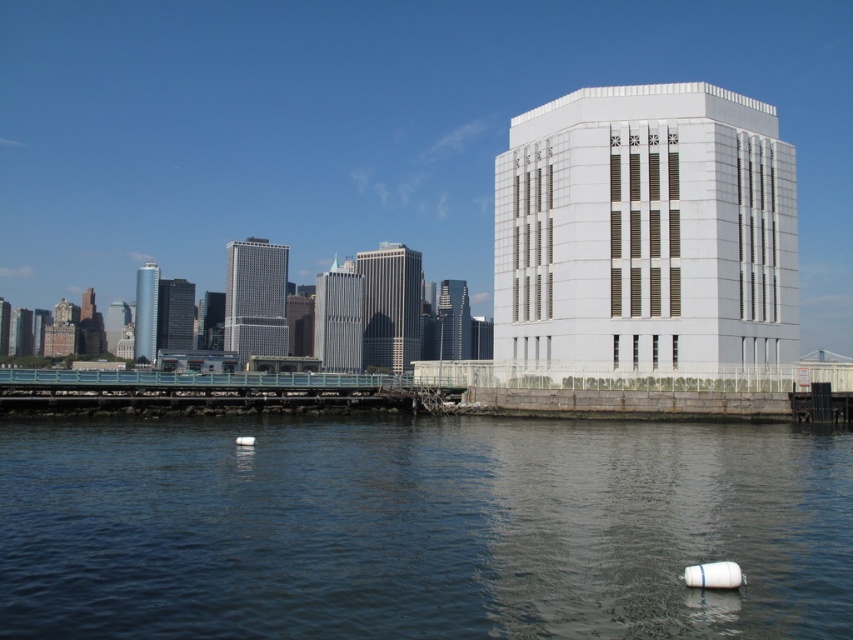
Can you confirm if silver reflective skyscraper at center is positioned to the left of black glass tower at center-left?

In fact, silver reflective skyscraper at center is to the right of black glass tower at center-left.

Between silver reflective skyscraper at center and black glass tower at center-left, which one is positioned higher?

Positioned higher is black glass tower at center-left.

Between point (270, 248) and point (183, 324), which one is positioned in front?

Point (270, 248) is in front.

Find the location of a particular element. This screenshot has width=853, height=640. silver reflective skyscraper at center is located at coordinates (254, 298).

Looking at this image, is clear water at lower center taller than shiny glass skyscraper at center?

Incorrect, clear water at lower center's height is not larger of shiny glass skyscraper at center's.

Can you confirm if clear water at lower center is smaller than shiny glass skyscraper at center?

Indeed, clear water at lower center has a smaller size compared to shiny glass skyscraper at center.

Where is `clear water at lower center`? The image size is (853, 640). clear water at lower center is located at coordinates (419, 529).

Who is more forward, (337, 500) or (225, 340)?

Point (337, 500)

I want to click on clear water at lower center, so click(419, 529).